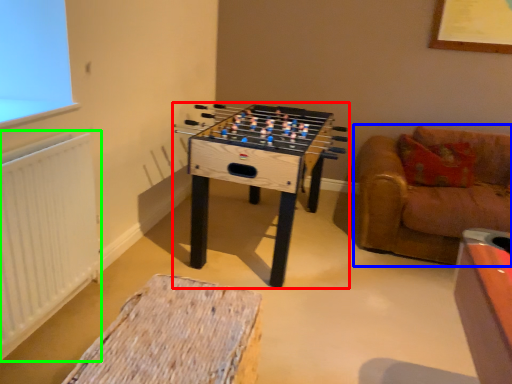
Question: Estimate the real-world distances between objects in this image. Which object is farther from table (highlighted by a red box), studio couch (highlighted by a blue box) or radiator (highlighted by a green box)?

Choices:
 (A) studio couch
 (B) radiator

Answer: (B)